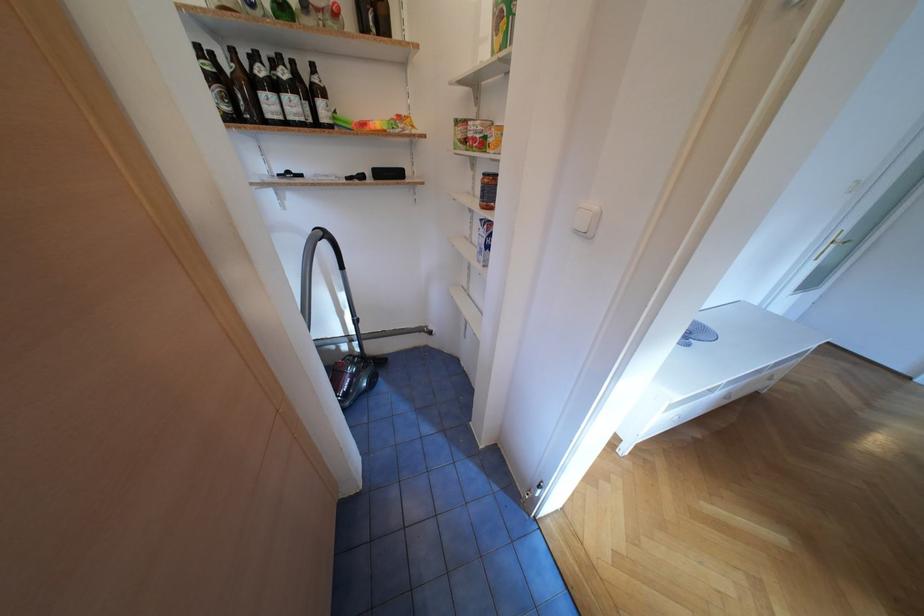
Find the location of a particular element. gold door handle is located at coordinates (843, 241).